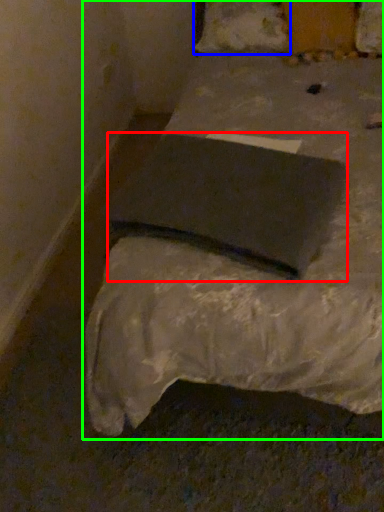
Question: Estimate the real-world distances between objects in this image. Which object is farther from pad (highlighted by a red box), pillow (highlighted by a blue box) or bed (highlighted by a green box)?

Choices:
 (A) pillow
 (B) bed

Answer: (A)